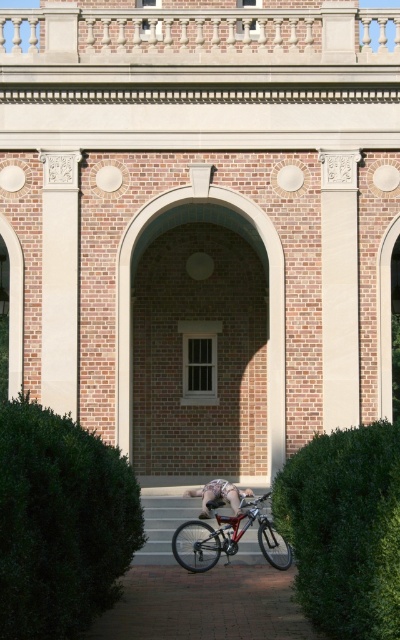
You are a delivery person who needs to park your shiny metallic bicycle at center near the green leafy hedge at lower left. Can you park the bicycle close to the hedge without blocking the pathway between them?

The green leafy hedge at lower left is in front of the shiny metallic bicycle at center, meaning the bicycle is already positioned behind the hedge. To park the bicycle close to the hedge without blocking the pathway, you can move it slightly backward so it remains behind the hedge but closer to it, ensuring the path between them stays clear.

You are a gardener who needs to trim the green leafy hedge at lower left and the skinny jeans at center. Which object requires more time to trim?

The green leafy hedge at lower left requires more time to trim because it is larger in size than the skinny jeans at center.